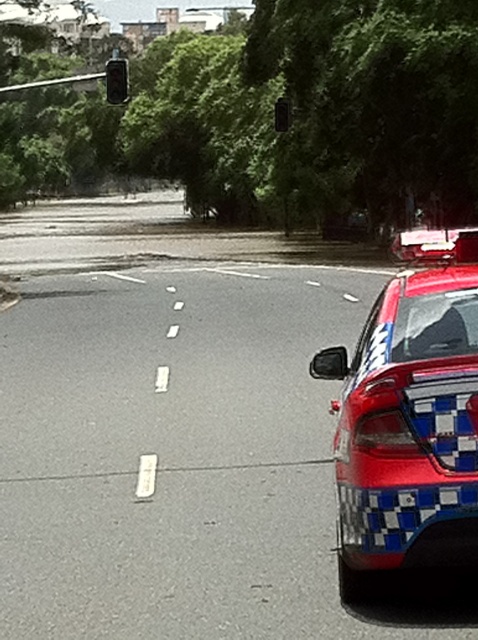
Does red glossy police car at right have a larger size compared to metallic traffic light at upper center?

Actually, red glossy police car at right might be smaller than metallic traffic light at upper center.

Is red glossy police car at right to the left of metallic traffic light at upper center from the viewer's perspective?

Indeed, red glossy police car at right is positioned on the left side of metallic traffic light at upper center.

Who is more distant from viewer, (400, 339) or (282, 109)?

The point (282, 109) is more distant.

Image resolution: width=478 pixels, height=640 pixels. What are the coordinates of `red glossy police car at right` in the screenshot? It's located at (409, 424).

Is red glossy police car at right above metallic black traffic light at upper left?

No, red glossy police car at right is not above metallic black traffic light at upper left.

Is point (467, 561) behind point (123, 67)?

No, (467, 561) is closer to viewer.

Consider the image. Who is more distant from viewer, (x=368, y=412) or (x=119, y=61)?

The point (x=119, y=61) is behind.

What are the coordinates of `red glossy police car at right` in the screenshot? It's located at (409, 424).

Is metallic black traffic light at upper left bigger than metallic traffic light at upper center?

Indeed, metallic black traffic light at upper left has a larger size compared to metallic traffic light at upper center.

Between metallic black traffic light at upper left and metallic traffic light at upper center, which one is positioned lower?

Positioned lower is metallic traffic light at upper center.

Locate an element on the screen. metallic black traffic light at upper left is located at coordinates (117, 81).